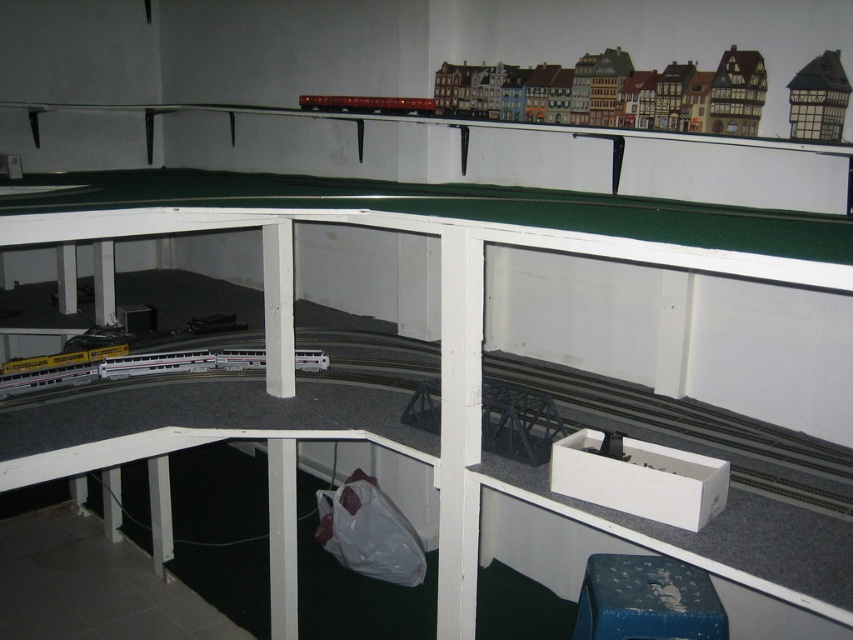
Can you confirm if white plastic train track at lower left is positioned to the right of metallic red train at upper center?

Correct, you'll find white plastic train track at lower left to the right of metallic red train at upper center.

Is white plastic train track at lower left further to the viewer compared to metallic red train at upper center?

That is False.

Does point (47, 403) lie in front of point (355, 108)?

Yes, point (47, 403) is in front of point (355, 108).

Find the location of a particular element. white plastic train track at lower left is located at coordinates (694, 429).

Is white plastic train track at lower left closer to the viewer compared to wooden house at upper right?

Yes, white plastic train track at lower left is closer to the viewer.

Based on the photo, measure the distance between white plastic train track at lower left and wooden house at upper right.

white plastic train track at lower left and wooden house at upper right are 3.59 feet apart from each other.

Is point (624, 422) positioned after point (814, 92)?

Yes.

This screenshot has width=853, height=640. What are the coordinates of `white plastic train track at lower left` in the screenshot? It's located at (694, 429).

Does wooden house at upper right come behind metallic red train at upper center?

No, wooden house at upper right is in front of metallic red train at upper center.

At what (x,y) coordinates should I click in order to perform the action: click on wooden house at upper right. Please return your answer as a coordinate pair (x, y). This screenshot has height=640, width=853. Looking at the image, I should click on (817, 99).

Where is `wooden house at upper right`? The height and width of the screenshot is (640, 853). wooden house at upper right is located at coordinates (817, 99).